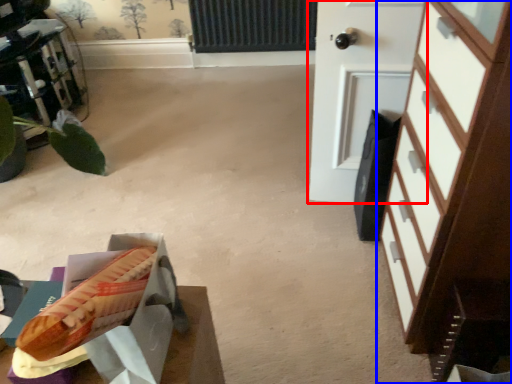
Question: Among these objects, which one is farthest to the camera, door (highlighted by a red box) or chest of drawers (highlighted by a blue box)?

Choices:
 (A) door
 (B) chest of drawers

Answer: (A)